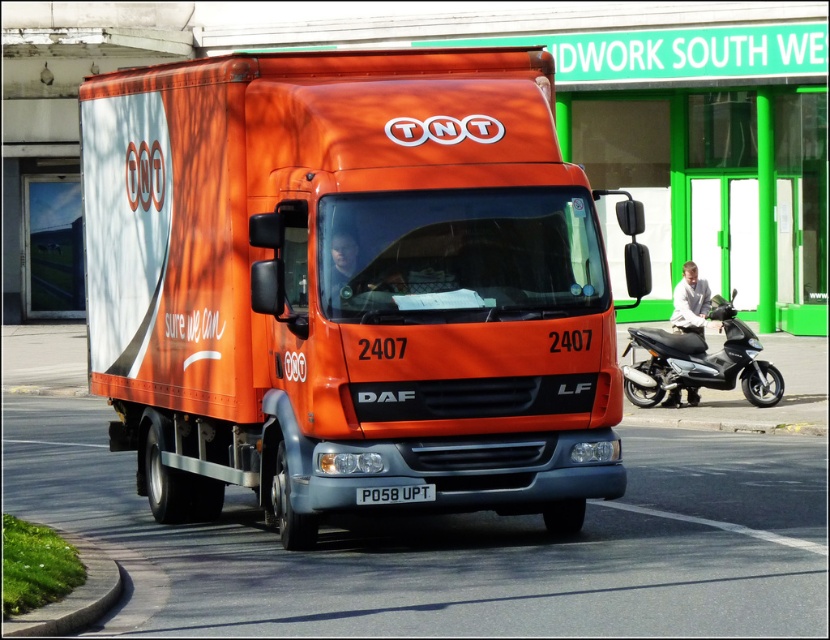
Is the position of black matte scooter at right less distant than that of white plastic license plate at center?

No, black matte scooter at right is further to the viewer.

Who is more distant from viewer, (758, 400) or (428, 486)?

The point (758, 400) is more distant.

Is point (657, 349) farther from camera compared to point (422, 497)?

Yes, point (657, 349) is behind point (422, 497).

Identify the location of black matte scooter at right. (699, 362).

Based on the photo, who is positioned more to the right, orange matte truck at center or black matte scooter at right?

black matte scooter at right is more to the right.

Which is in front, point (251, 275) or point (704, 352)?

Point (251, 275) is more forward.

Identify the location of orange matte truck at center. The image size is (830, 640). (349, 285).

In the scene shown: Does orange matte truck at center have a greater height compared to white plastic license plate at center?

Indeed, orange matte truck at center has a greater height compared to white plastic license plate at center.

The height and width of the screenshot is (640, 830). Describe the element at coordinates (349, 285) in the screenshot. I see `orange matte truck at center` at that location.

The height and width of the screenshot is (640, 830). I want to click on orange matte truck at center, so click(x=349, y=285).